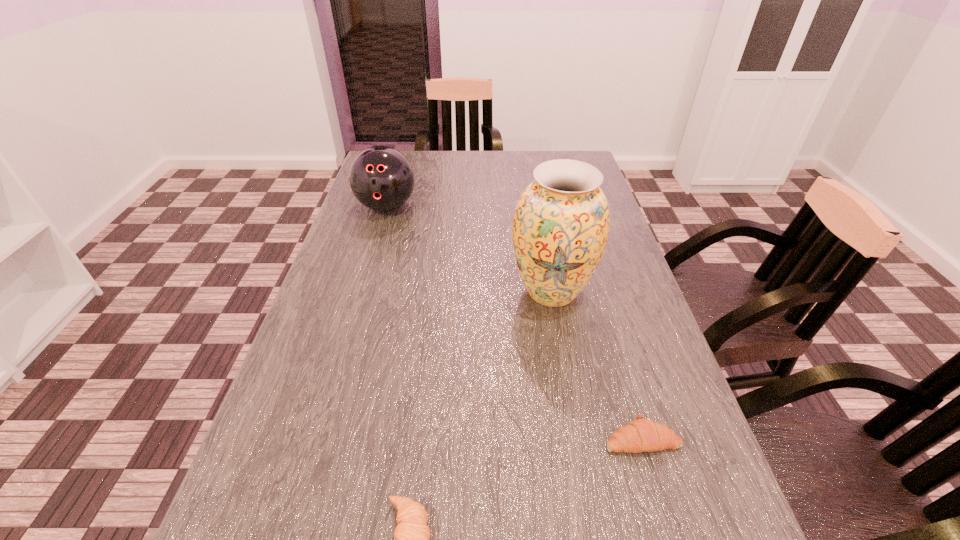
Identify the location of vase at the right edge. (560, 229).

Identify the location of crescent roll that is at the right edge. This screenshot has height=540, width=960. 641,435.

Find the location of a particular element. vacant space at the far edge of the desktop is located at coordinates (463, 162).

At what (x,y) coordinates should I click in order to perform the action: click on vacant region at the left edge of the desktop. Please return your answer as a coordinate pair (x, y). Looking at the image, I should click on (261, 509).

Locate an element on the screen. The image size is (960, 540). vacant space at the right edge of the desktop is located at coordinates (707, 530).

At what (x,y) coordinates should I click in order to perform the action: click on vacant region at the far right corner. Please return your answer as a coordinate pair (x, y). The width and height of the screenshot is (960, 540). Looking at the image, I should click on (543, 151).

Locate an element on the screen. This screenshot has width=960, height=540. unoccupied area between the farther crescent roll and the vase is located at coordinates (596, 365).

What are the coordinates of `free spot between the second nearest object and the bowling ball` in the screenshot? It's located at (515, 322).

Find the location of `vacant space that's between the right crescent roll and the bowling ball`. vacant space that's between the right crescent roll and the bowling ball is located at coordinates (515, 322).

Find the location of a particular element. free space between the second nearest object and the bowling ball is located at coordinates (515, 322).